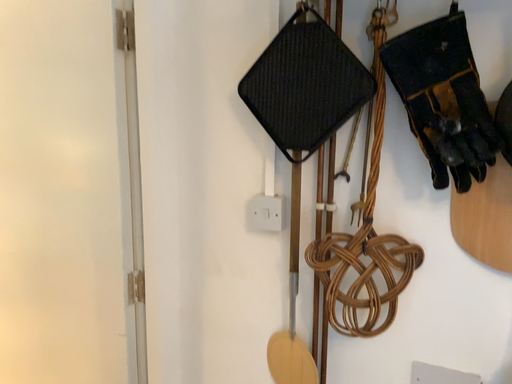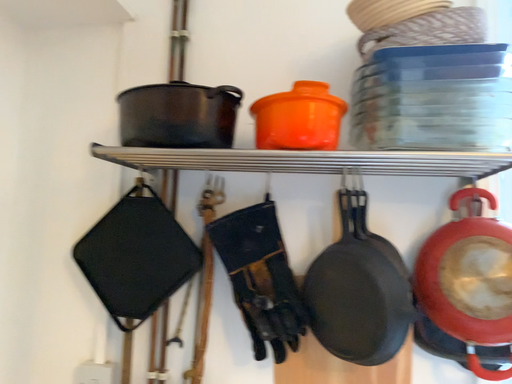
Question: Which way did the camera rotate in the video?

Choices:
 (A) rotated upward
 (B) rotated downward

Answer: (A)